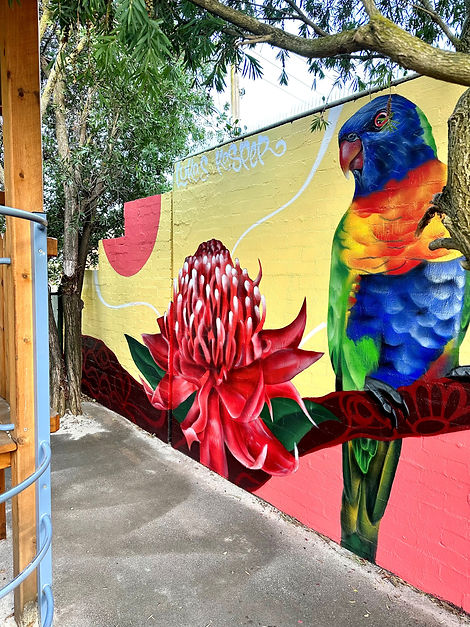
I want to click on white mural line painting, so click(268, 214), click(118, 303).